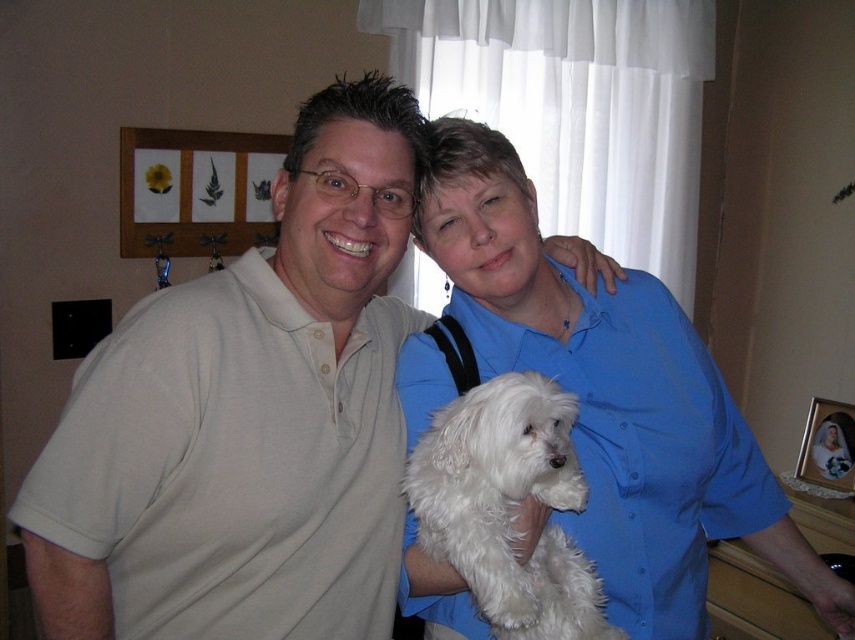
Can you confirm if matte beige polo shirt at left is positioned to the right of blue satin blouse at upper center?

No, matte beige polo shirt at left is not to the right of blue satin blouse at upper center.

The height and width of the screenshot is (640, 855). Describe the element at coordinates (246, 419) in the screenshot. I see `matte beige polo shirt at left` at that location.

The width and height of the screenshot is (855, 640). What are the coordinates of `matte beige polo shirt at left` in the screenshot? It's located at (246, 419).

Is the position of matte beige polo shirt at left less distant than that of white fluffy dog at center?

Yes, matte beige polo shirt at left is in front of white fluffy dog at center.

Which is more to the right, matte beige polo shirt at left or white fluffy dog at center?

white fluffy dog at center

Who is more forward, (128, 577) or (596, 586)?

Point (128, 577)

The image size is (855, 640). In order to click on matte beige polo shirt at left in this screenshot , I will do `click(246, 419)`.

Looking at this image, which is more to the right, matte beige polo shirt at left or blue smooth shirt at center?

From the viewer's perspective, blue smooth shirt at center appears more on the right side.

Does matte beige polo shirt at left have a smaller size compared to blue smooth shirt at center?

Yes.

Locate an element on the screen. The image size is (855, 640). matte beige polo shirt at left is located at coordinates (246, 419).